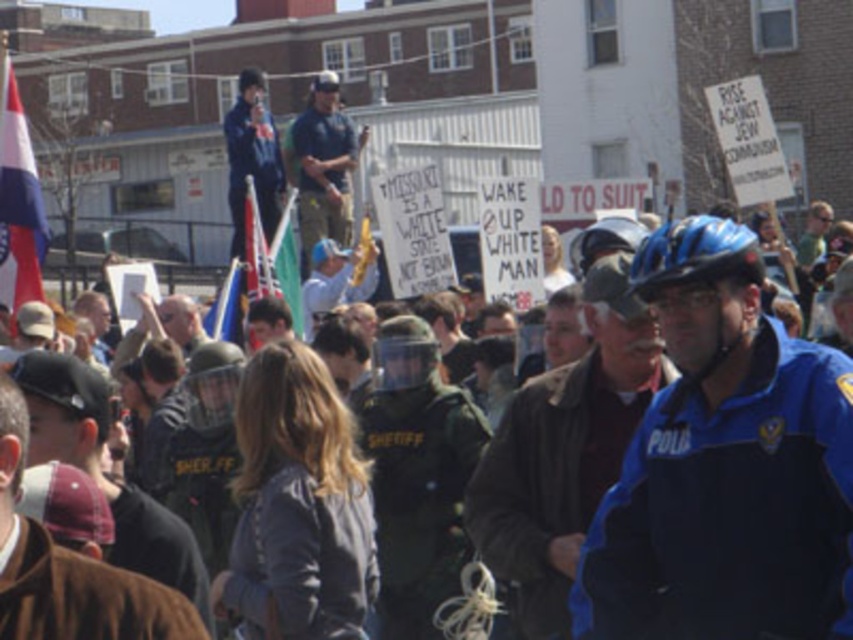
You are a photographer standing in the crowd at the protest. You want to take a photo that includes both the police officer on the right and the person in the green uniform labeled SHER. Which of the two points, point 1 at coordinates [732,390] or point 2 at coordinates [282,212], should you focus on to ensure both subjects are in sharp focus?

You should focus on point 1 at coordinates [732,390] because it is closer to the viewer than point 2 at coordinates [282,212]. This will ensure that both the police officer on the right and the person in the green uniform labeled SHER are in focus as the depth of field will cover both distances.